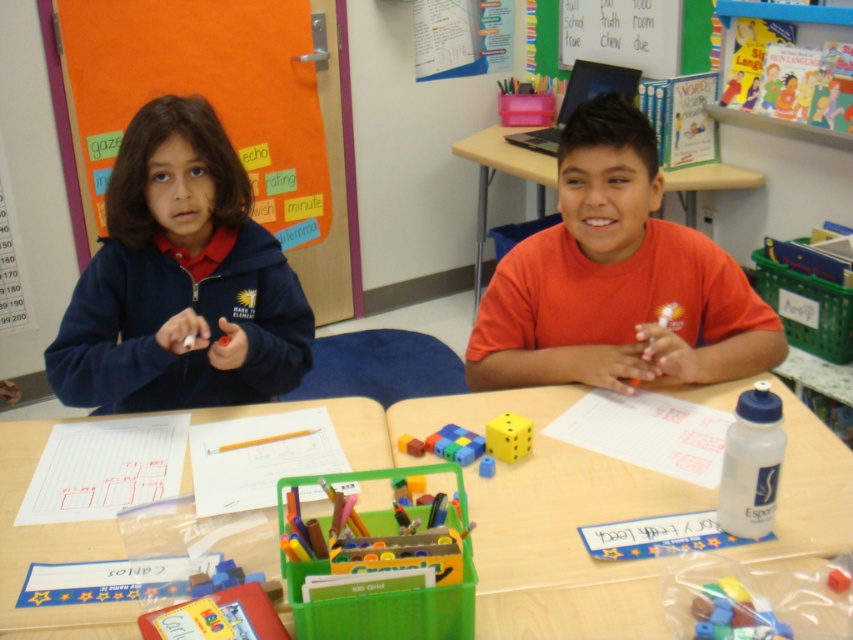
Question: Where is translucent plastic blocks at center located in relation to rubber dice at center in the image?

Choices:
 (A) left
 (B) right

Answer: (B)

Question: Which of these objects is positioned farthest from the yellow matte dice at center?

Choices:
 (A) translucent plastic blocks at center
 (B) orange matte shirt at center

Answer: (A)

Question: Is the position of orange matte shirt at center more distant than that of translucent plastic blocks at center?

Choices:
 (A) no
 (B) yes

Answer: (B)

Question: Among these objects, which one is farthest from the camera?

Choices:
 (A) translucent plastic blocks at center
 (B) wooden table at center
 (C) rubber dice at center
 (D) orange matte bulletin board at upper left

Answer: (D)

Question: In this image, where is orange matte shirt at center located relative to orange matte bulletin board at upper left?

Choices:
 (A) right
 (B) left

Answer: (A)

Question: Among these objects, which one is farthest from the camera?

Choices:
 (A) translucent plastic blocks at center
 (B) orange matte shirt at center
 (C) yellow matte dice at center
 (D) rubber dice at center

Answer: (B)